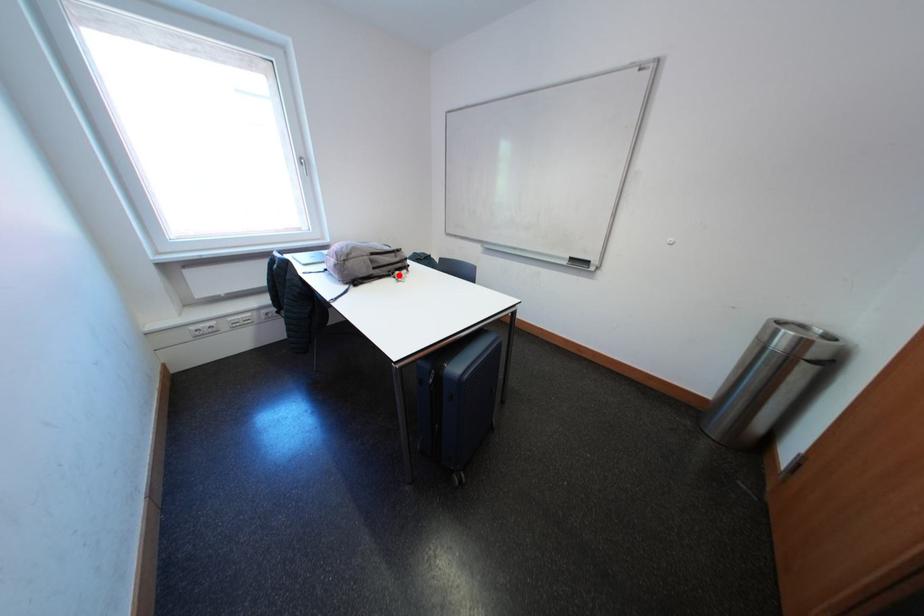
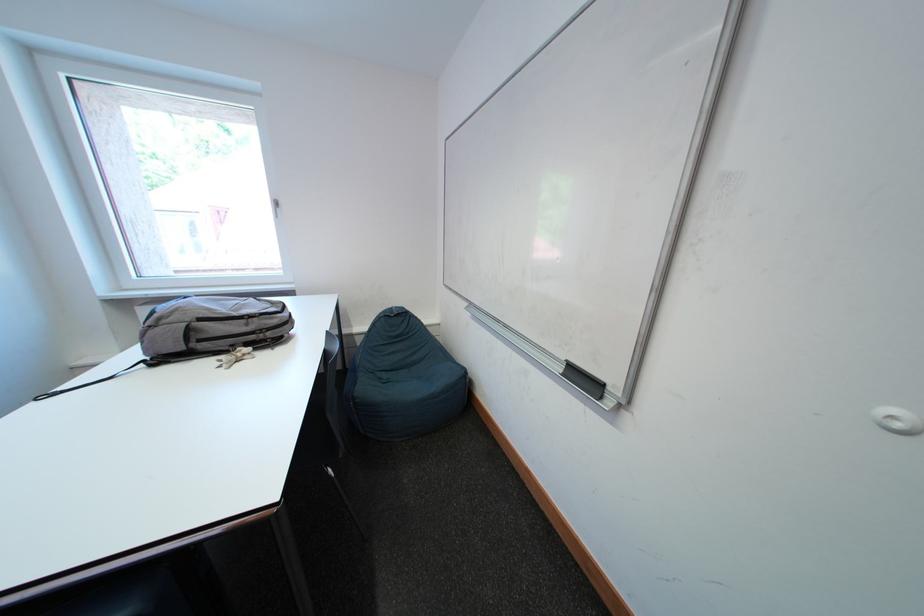
The point at the highlighted location is marked in the first image. Where is the corresponding point in the second image?

(241, 349)